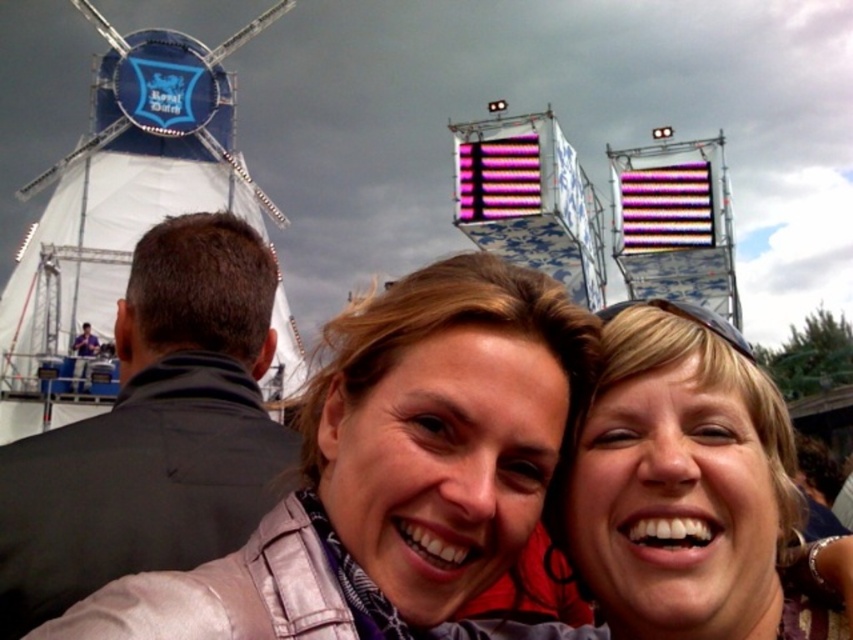
You are a photographer trying to capture a photo of the matte gray jacket at center and the black leather jacket at upper left. Which jacket is positioned lower in the image?

The matte gray jacket at center is positioned lower than the black leather jacket at upper left.

In the scene shown: You are a photographer trying to capture a photo of the two jackets in the scene. Since you want to ensure both jackets are visible in the frame, which jacket should you focus on to include both the matte gray jacket at center and the black leather jacket at upper left without cropping either?

You should focus on the matte gray jacket at center since it is larger and centered, making it easier to frame both jackets while ensuring the smaller black leather jacket at upper left remains visible in the shot.